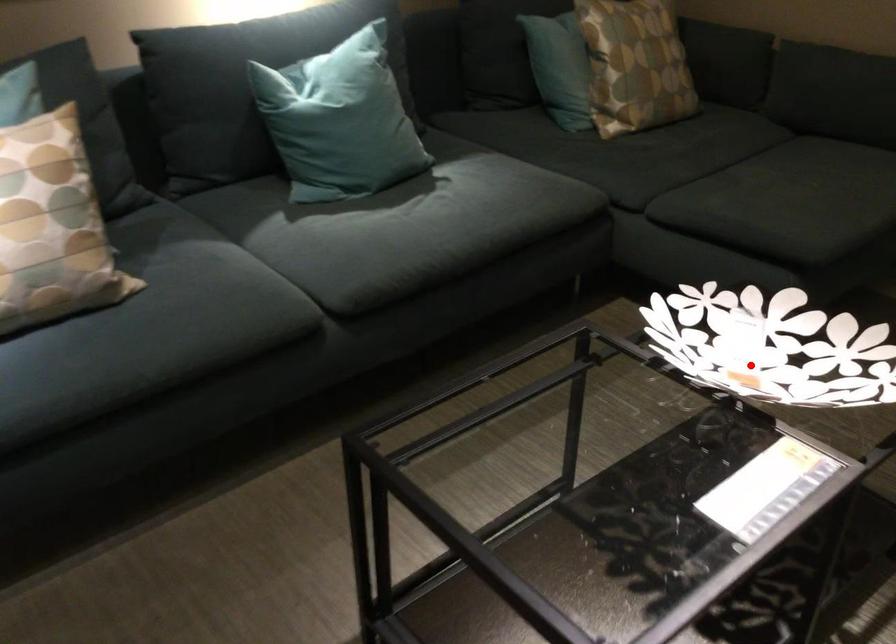
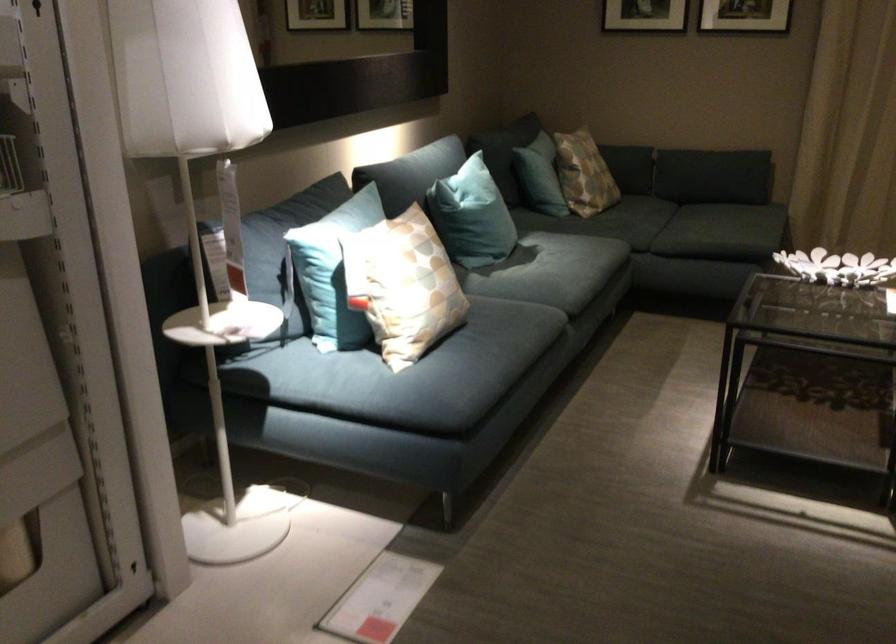
Find the pixel in the second image that matches the highlighted location in the first image.

(837, 267)